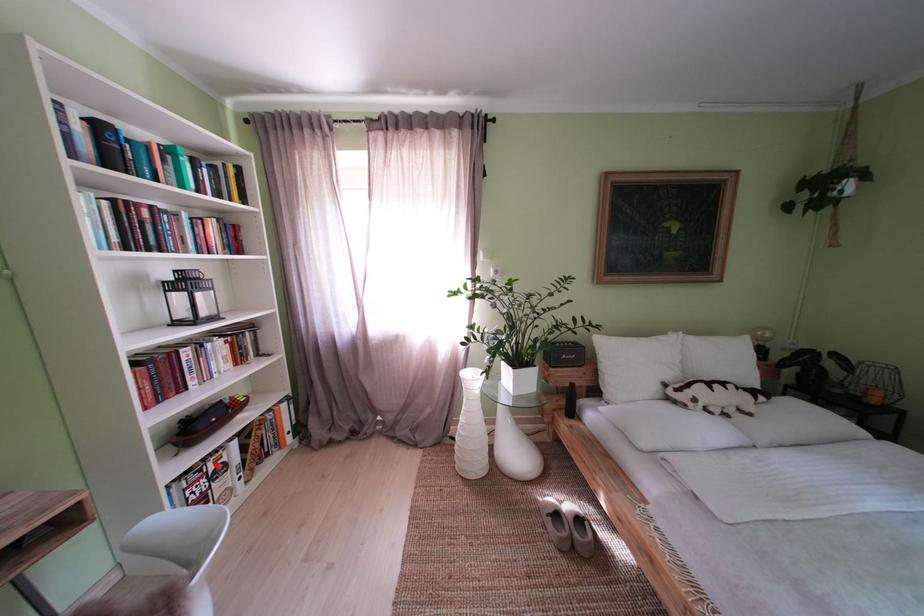
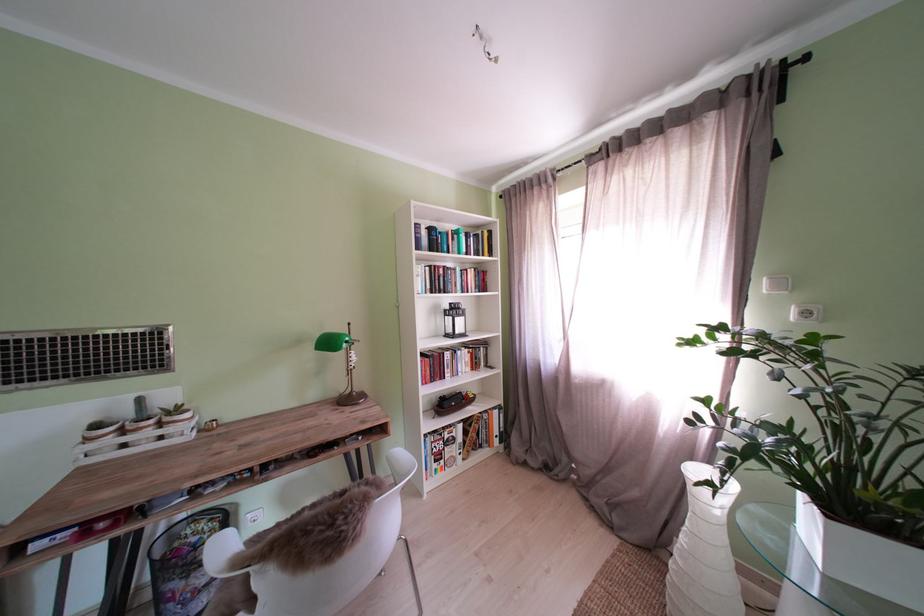
In the second image, find the point that corresponds to the highlighted location in the first image.

(456, 434)